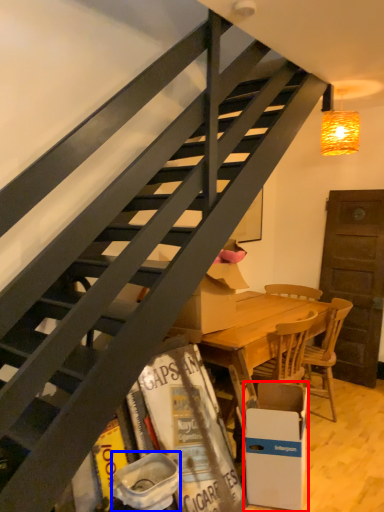
Question: Which point is further to the camera, box (highlighted by a red box) or trash bin/can (highlighted by a blue box)?

Choices:
 (A) box
 (B) trash bin/can

Answer: (A)